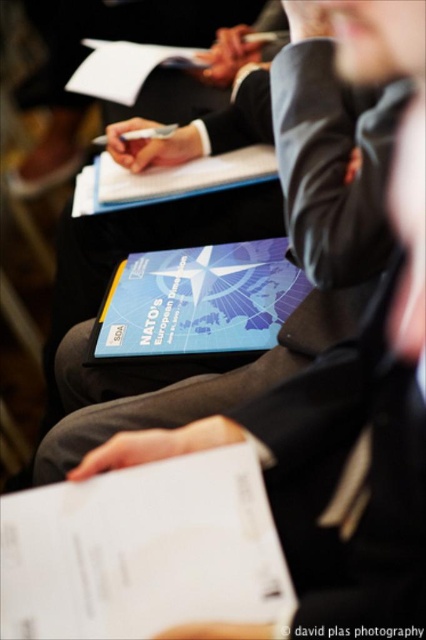
You are a photographer adjusting your camera to focus on two points in the image. The first point is labeled as point (187, 294) and the second is point (354, 620). Which point should you focus on first if you want to ensure both points are in focus without moving the camera?

You should focus on point (187, 294) first because it is closer to the camera than point (354, 620). By focusing on the closer point, the depth of field may extend to include the farther point in focus as well.

You are attending a formal meeting and notice the dark gray wool business suit at center. Where exactly is it positioned in the room?

The dark gray wool business suit at center is located at point 0.395 along the horizontal axis and 0.681 along the vertical axis.